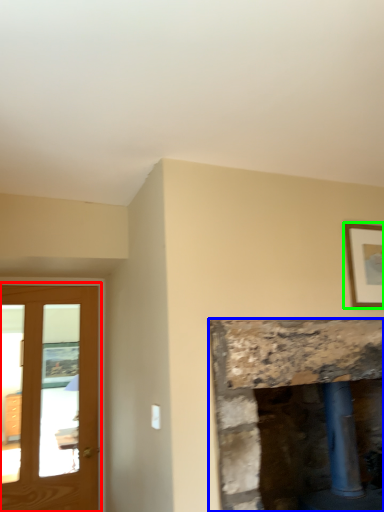
Question: Which object is the closest to the screen door (highlighted by a red box)? Choose among these: fireplace (highlighted by a blue box) or picture frame (highlighted by a green box).

Choices:
 (A) fireplace
 (B) picture frame

Answer: (A)